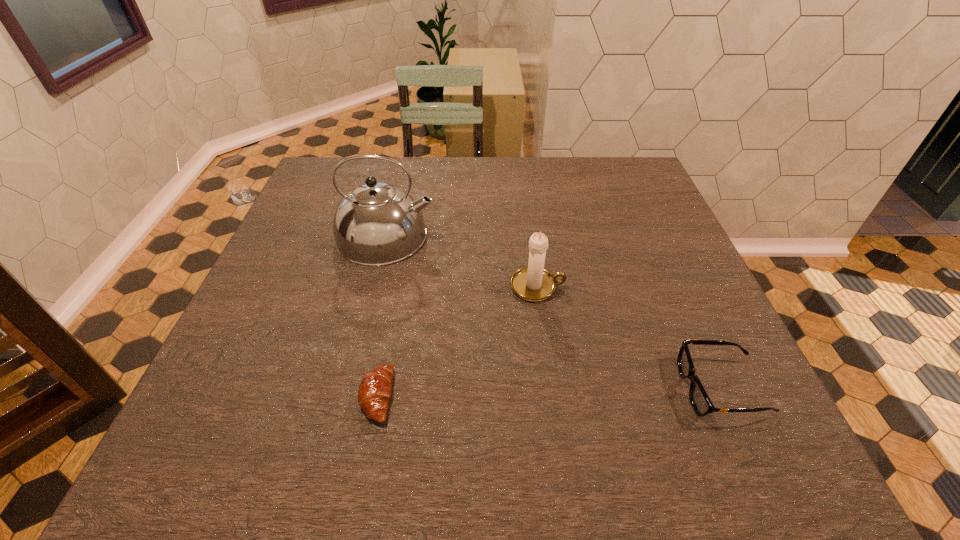
The width and height of the screenshot is (960, 540). Identify the location of vacant area that lies between the third tallest object and the shortest object. (548, 392).

The height and width of the screenshot is (540, 960). I want to click on vacant space that's between the crescent roll and the third nearest object, so click(457, 341).

Find the location of a particular element. This screenshot has width=960, height=540. vacant area that lies between the shortest object and the tallest object is located at coordinates (381, 316).

I want to click on unoccupied position between the rightmost object and the farthest object, so click(x=553, y=312).

Where is `unoccupied area between the second farthest object and the sunglasses`? This screenshot has height=540, width=960. unoccupied area between the second farthest object and the sunglasses is located at coordinates (629, 338).

The image size is (960, 540). Find the location of `unoccupied position between the tallest object and the crescent roll`. unoccupied position between the tallest object and the crescent roll is located at coordinates (381, 316).

Locate an element on the screen. The width and height of the screenshot is (960, 540). free spot between the candle holder and the crescent roll is located at coordinates (457, 341).

Identify the location of free space between the third tallest object and the crescent roll. (548, 392).

Where is `free point between the tallest object and the rightmost object`? Image resolution: width=960 pixels, height=540 pixels. free point between the tallest object and the rightmost object is located at coordinates (553, 312).

I want to click on vacant area between the candle holder and the crescent roll, so click(457, 341).